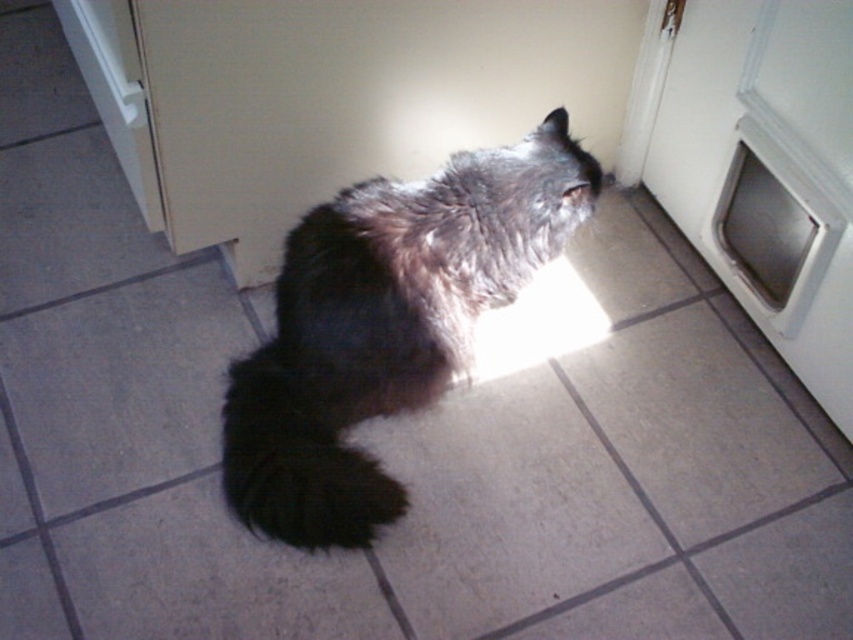
You are a cat owner who wants to ensure your cat can move freely between the living room and the backyard through the pet door. You notice the dark fur cat at center and the black fluffy tail at lower center. Which object is closer to the pet door?

The black fluffy tail at lower center is behind the dark fur cat at center, so the dark fur cat at center is closer to the pet door.

You are a cat owner who wants to ensure your cat can comfortably reach the pet door. The cat has a tail that is 32.98 inches away from the pet door. Given that the cat needs at least 12 inches of space to maneuver, is the distance between the black fluffy tail at lower center and the white plastic pet door at center right sufficient?

The black fluffy tail at lower center is 32.98 inches from the white plastic pet door at center right. Since the required space is 12 inches, the distance is more than enough for the cat to maneuver comfortably.

You are a cat owner who wants to ensure your cat can comfortably pass through the white plastic pet door at center right. Considering the cat has a black fluffy tail at lower center, will the tail fit through the pet door without getting stuck?

The black fluffy tail at lower center is below the white plastic pet door at center right, so the tail is positioned away from the pet door. Therefore, the tail should not get stuck in the pet door when the cat passes through.